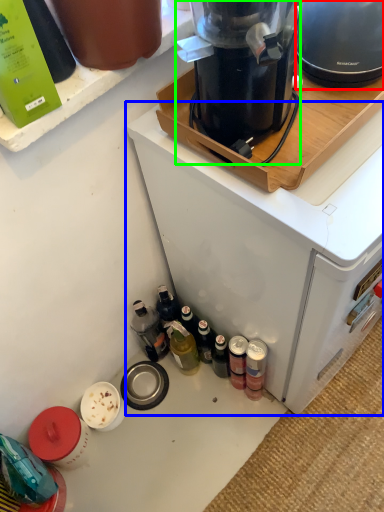
Question: Which is farther away from kitchen appliance (highlighted by a red box)? home appliance (highlighted by a blue box) or kitchen appliance (highlighted by a green box)?

Choices:
 (A) home appliance
 (B) kitchen appliance

Answer: (A)